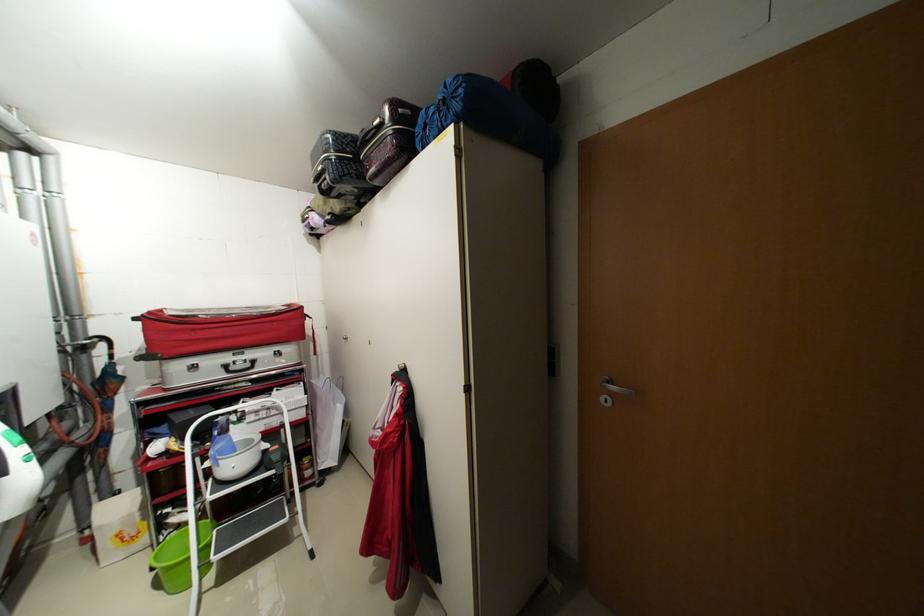
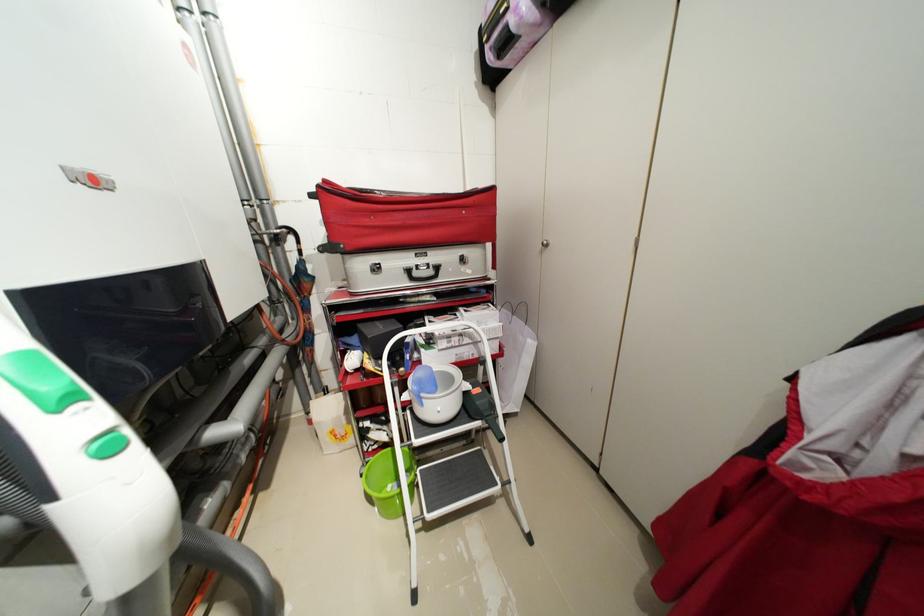
The point at (283, 448) is marked in the first image. Where is the corresponding point in the second image?

(484, 391)